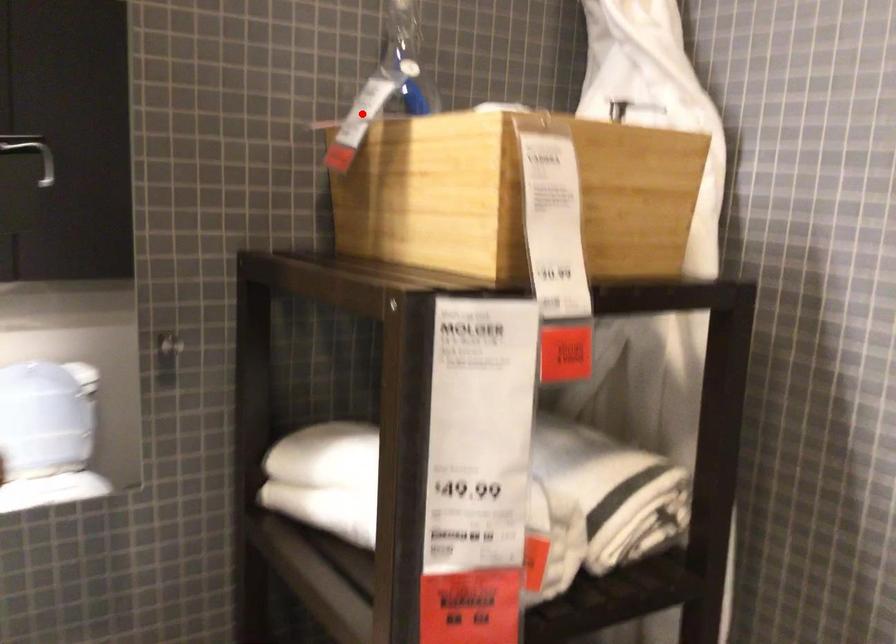
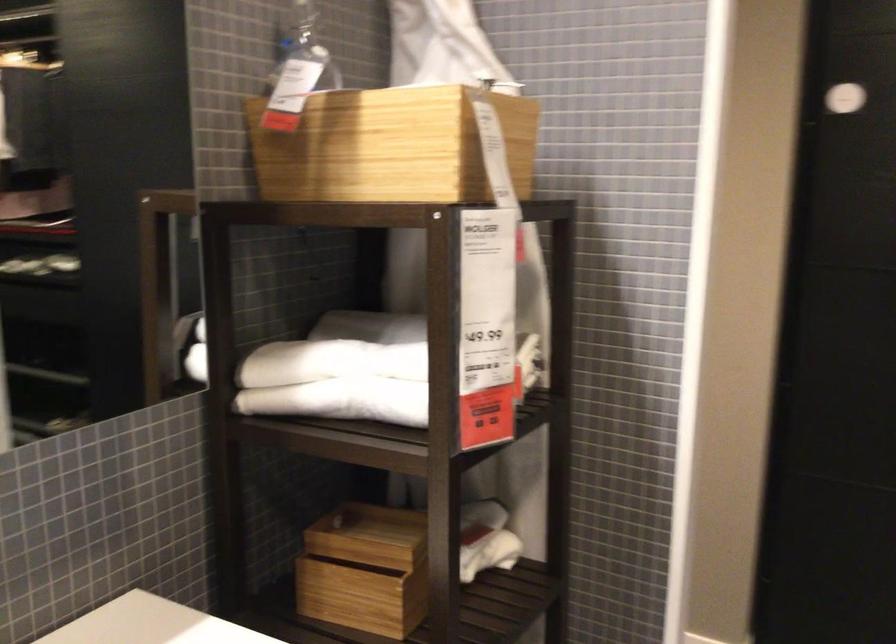
The point at the highlighted location is marked in the first image. Where is the corresponding point in the second image?

(297, 91)